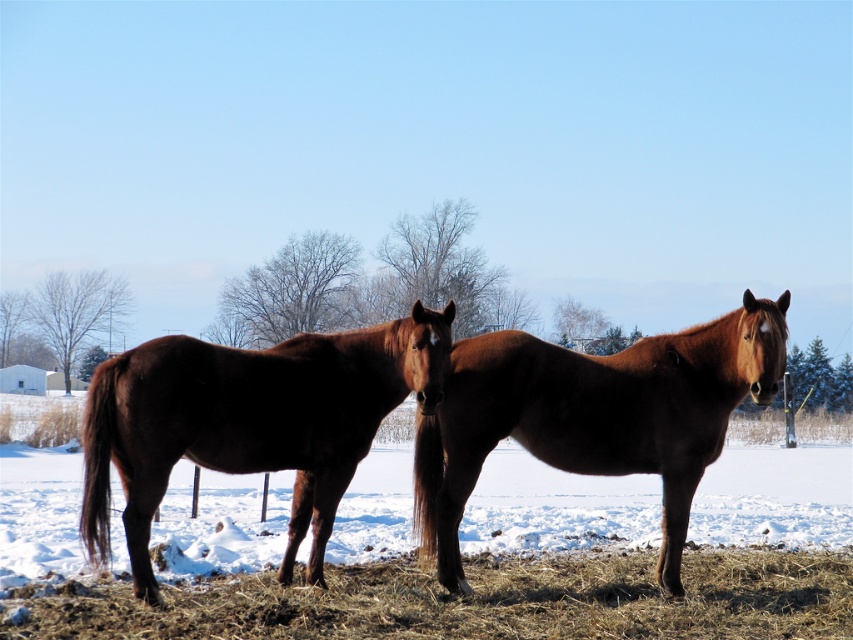
You are standing in the snowy field and want to walk from the point at coordinates point (131, 508) to the point at coordinates point (619, 461). Which direction should you move relative to the two points?

You should move towards the point at coordinates point (619, 461), which is behind the point at coordinates point (131, 508) based on their spatial arrangement.

You are a farmer who needs to clear the path between the dry straw at lower center and the brown glossy horse at center. Since the path must be wide enough for a tractor, which is 2 meters wide, can you determine if the space between them is sufficient?

The dry straw at lower center has a lesser width compared to brown glossy horse at center. Since the dry straw is narrower, the space between them might be sufficient for the tractor. However, without knowing the exact distance between them, it is uncertain. Please measure the distance between the dry straw at lower center and the brown glossy horse at center to confirm.

In the scene shown: You are a photographer positioned at the origin point of the image. You want to take a photo of the brown glossy horse at left. What are the coordinates where you should aim your camera?

The coordinates to aim your camera are at point (250, 420) to capture the brown glossy horse at left.